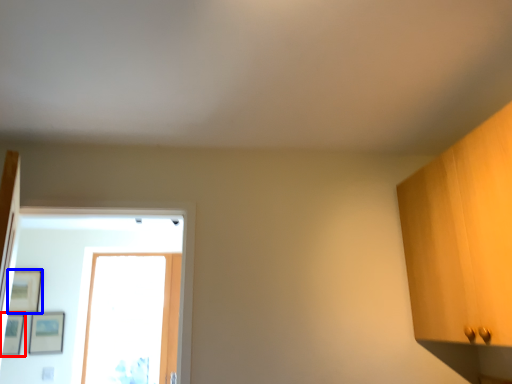
Question: Among these objects, which one is nearest to the camera, picture frame (highlighted by a red box) or picture frame (highlighted by a blue box)?

Choices:
 (A) picture frame
 (B) picture frame

Answer: (A)